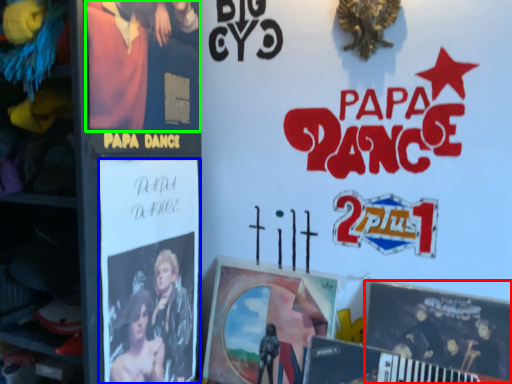
Question: Considering the real-world distances, which object is farthest from poster (highlighted by a red box)? poster (highlighted by a blue box) or person (highlighted by a green box)?

Choices:
 (A) poster
 (B) person

Answer: (B)